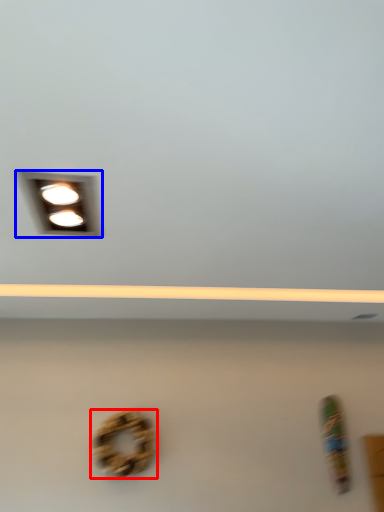
Question: Which object is further to the camera taking this photo, bagel (highlighted by a red box) or lamp (highlighted by a blue box)?

Choices:
 (A) bagel
 (B) lamp

Answer: (A)